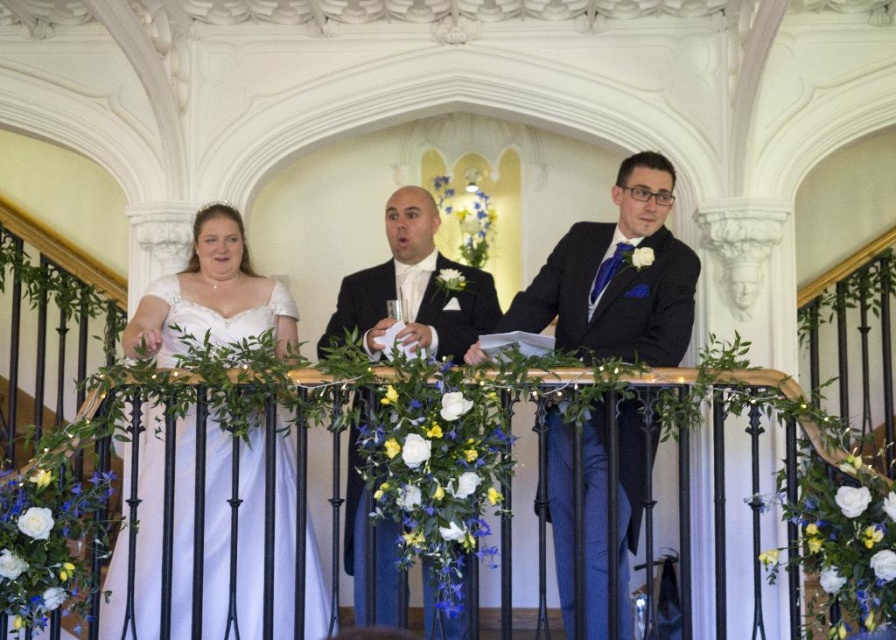
You are attending a wedding and notice a white satin dress at center on the staircase. If you want to take a photo of the dress from the bottom of the staircase, which direction should you move relative to the staircase railing?

The white satin dress at center is located at point (616, 276), so you should move towards the center of the staircase to capture the dress in your photo.

You are a photographer at the wedding and need to adjust the lighting so that both the white satin dress at center and the white satin dress at left are equally illuminated. Which dress requires more light adjustment to ensure proper exposure?

The white satin dress at center is much taller than the white satin dress at left, so it may require more light adjustment to ensure proper exposure due to its larger size.